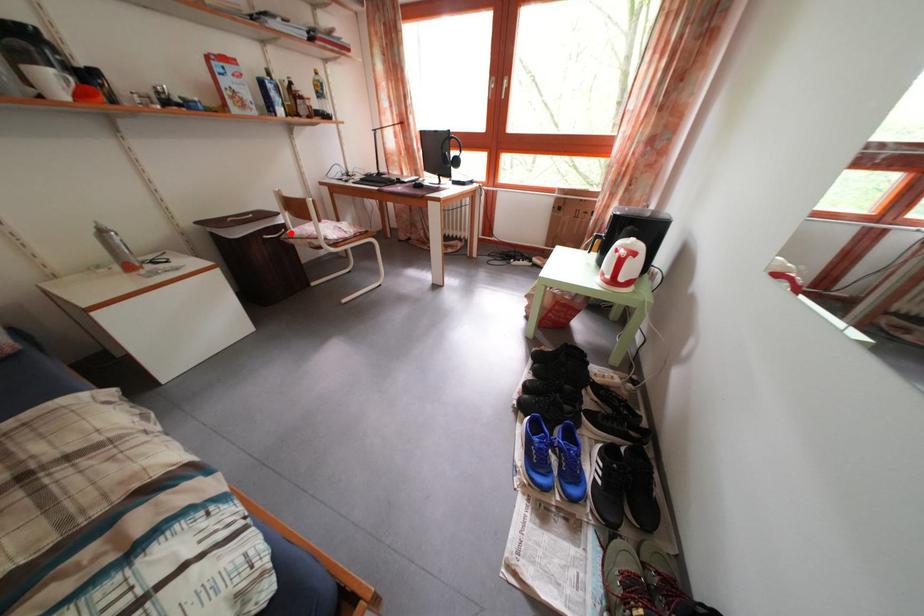
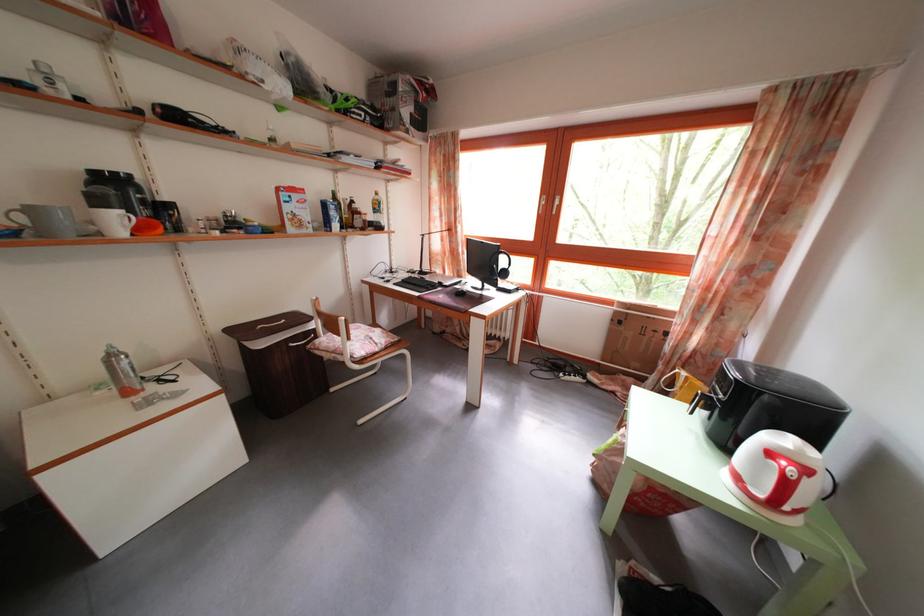
The point at the highlighted location is marked in the first image. Where is the corresponding point in the second image?

(322, 339)